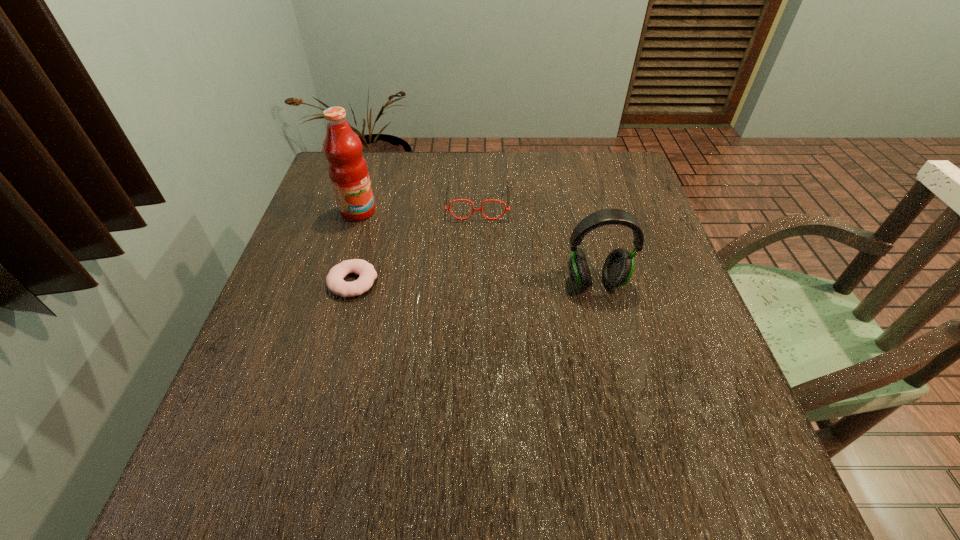
Image resolution: width=960 pixels, height=540 pixels. What are the coordinates of `free space at the left edge of the desktop` in the screenshot? It's located at (281, 309).

Where is `vacant area at the right edge`? This screenshot has height=540, width=960. vacant area at the right edge is located at coordinates (638, 314).

Image resolution: width=960 pixels, height=540 pixels. What are the coordinates of `vacant region at the far left corner of the desktop` in the screenshot? It's located at (378, 170).

In the image, there is a desktop. Find the location of `vacant region at the far right corner`. vacant region at the far right corner is located at coordinates (581, 158).

Identify the location of vacant space that is in between the third tallest object and the tallest object. (418, 207).

Locate an element on the screen. The height and width of the screenshot is (540, 960). vacant space in between the fruit juice and the spectacles is located at coordinates (418, 207).

The image size is (960, 540). In order to click on free point between the shortest object and the spectacles in this screenshot , I will do `click(416, 242)`.

This screenshot has height=540, width=960. In order to click on vacant area that lies between the doughnut and the third shortest object in this screenshot , I will do `click(474, 282)`.

Find the location of a particular element. The width and height of the screenshot is (960, 540). unoccupied area between the tallest object and the shortest object is located at coordinates (355, 247).

The width and height of the screenshot is (960, 540). I want to click on empty location between the doughnut and the headset, so click(474, 282).